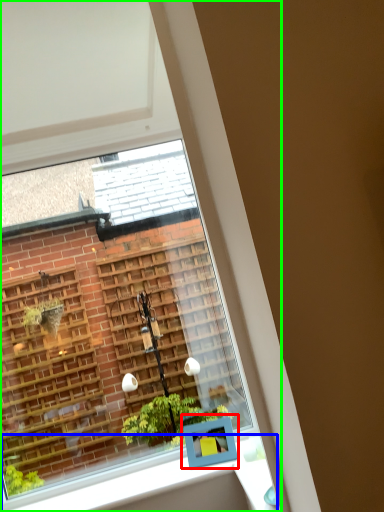
Question: Which object is positioned farthest from window box (highlighted by a red box)? Select from window sill (highlighted by a blue box) and window (highlighted by a green box).

Choices:
 (A) window sill
 (B) window

Answer: (B)